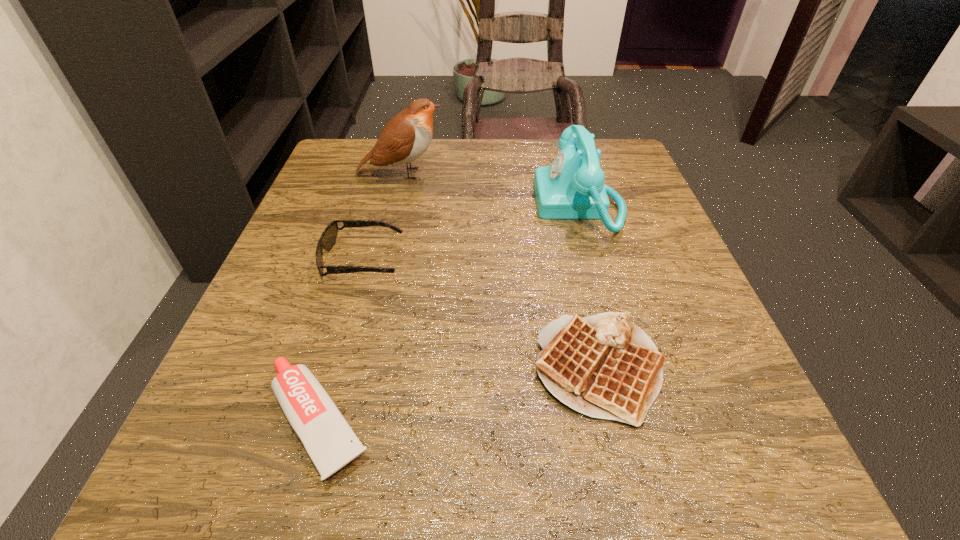
Identify the location of object positioned at the far left corner. This screenshot has height=540, width=960. (405, 138).

The image size is (960, 540). Find the location of `object located in the near left corner section of the desktop`. object located in the near left corner section of the desktop is located at coordinates (330, 442).

Locate an element on the screen. The height and width of the screenshot is (540, 960). object present at the far right corner is located at coordinates (572, 187).

At what (x,y) coordinates should I click in order to perform the action: click on vacant position at the far edge of the desktop. Please return your answer as a coordinate pair (x, y). Looking at the image, I should click on (423, 188).

Identify the location of free space at the near edge. Image resolution: width=960 pixels, height=540 pixels. (490, 467).

In the image, there is a desktop. Where is `vacant region at the left edge`? Image resolution: width=960 pixels, height=540 pixels. vacant region at the left edge is located at coordinates point(364,276).

In the image, there is a desktop. In order to click on free region at the right edge in this screenshot , I will do `click(646, 215)`.

The height and width of the screenshot is (540, 960). What are the coordinates of `free space at the far left corner of the desktop` in the screenshot? It's located at [x=341, y=174].

At what (x,y) coordinates should I click in order to perform the action: click on free space at the far right corner of the desktop. Please return your answer as a coordinate pair (x, y). The height and width of the screenshot is (540, 960). Looking at the image, I should click on (x=618, y=180).

Identify the location of empty space between the waffle and the sunglasses. The image size is (960, 540). (481, 314).